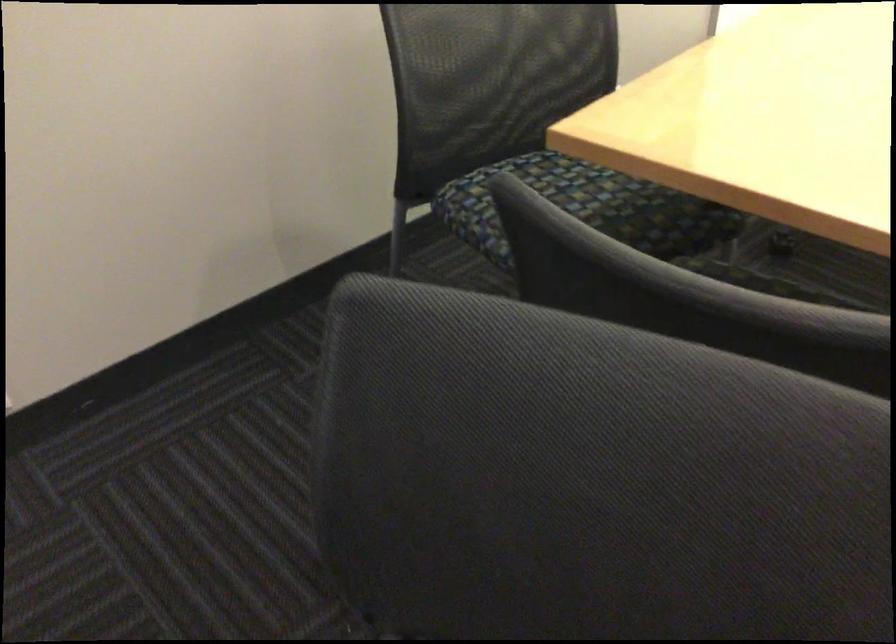
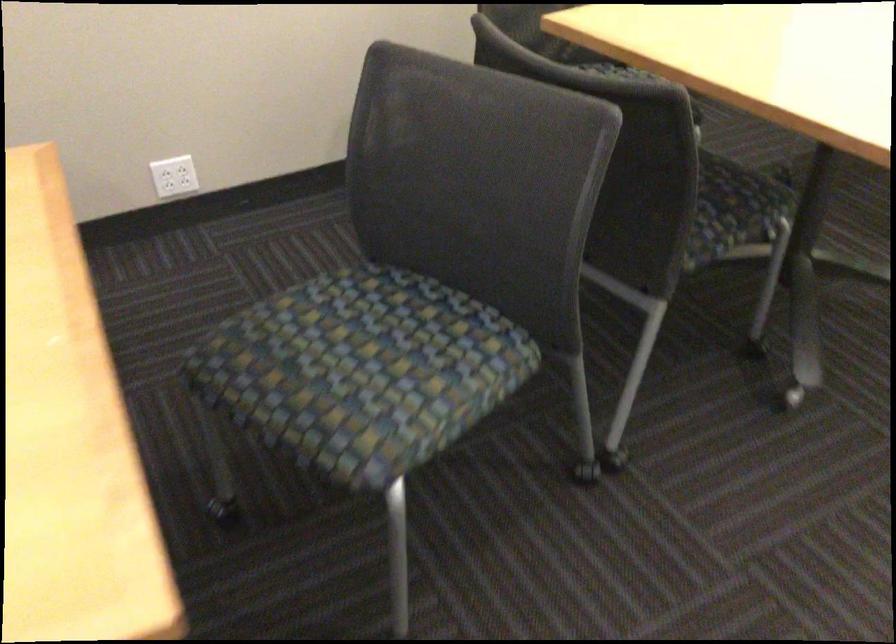
In a continuous first-person perspective shot, in which direction is the camera moving?

The cameraman walked toward right, backward.